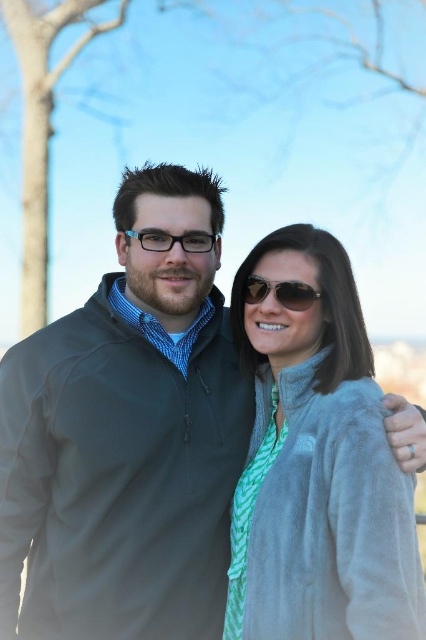
Question: Which object appears farthest from the camera in this image?

Choices:
 (A) gray fleece jacket at center
 (B) shiny black sunglasses at center

Answer: (B)

Question: Which object is farther from the camera taking this photo?

Choices:
 (A) fuzzy gray jacket at center
 (B) transparent plastic glasses at center
 (C) gray fleece jacket at center
 (D) shiny black sunglasses at center

Answer: (B)

Question: Is fuzzy gray jacket at center in front of shiny black sunglasses at center?

Choices:
 (A) yes
 (B) no

Answer: (A)

Question: Is fuzzy gray jacket at center in front of shiny black sunglasses at center?

Choices:
 (A) no
 (B) yes

Answer: (B)

Question: Can you confirm if fuzzy gray jacket at center is thinner than shiny black sunglasses at center?

Choices:
 (A) no
 (B) yes

Answer: (A)

Question: Considering the real-world distances, which object is farthest from the transparent plastic glasses at center?

Choices:
 (A) gray fleece jacket at center
 (B) shiny black sunglasses at center
 (C) fuzzy gray jacket at center

Answer: (C)